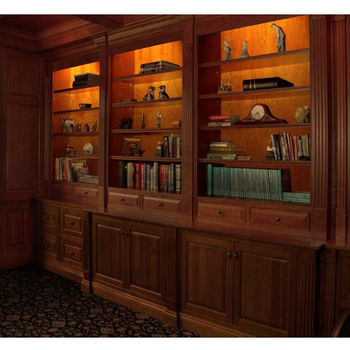
The image size is (350, 350). In order to click on drawer in this screenshot , I will do [x=65, y=194], [x=90, y=198], [x=120, y=204], [x=148, y=212], [x=211, y=215], [x=267, y=218], [x=43, y=224], [x=74, y=230], [x=49, y=253], [x=65, y=260].